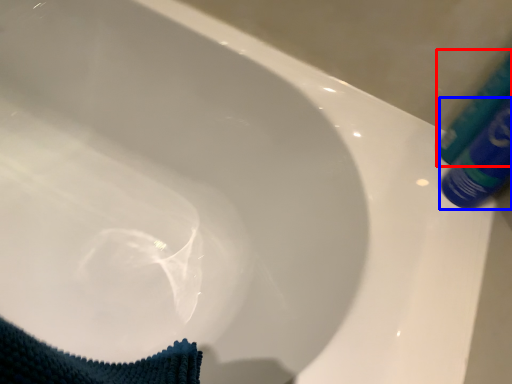
Question: Which object appears closest to the camera in this image, tube (highlighted by a red box) or tube (highlighted by a blue box)?

Choices:
 (A) tube
 (B) tube

Answer: (B)